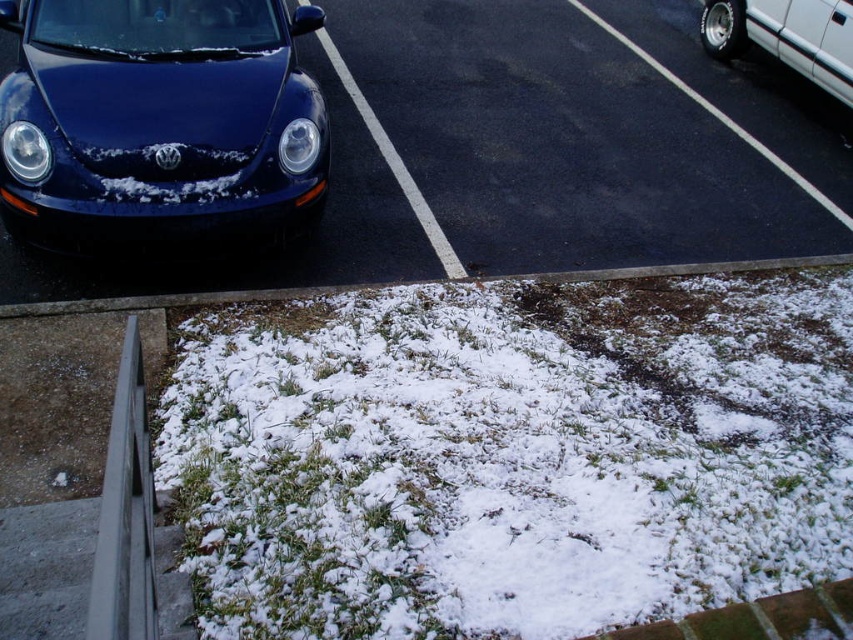
Can you confirm if matte blue car at left is smaller than white metallic car at upper right?

No, matte blue car at left is not smaller than white metallic car at upper right.

Consider the image. Is matte blue car at left to the right of white metallic car at upper right from the viewer's perspective?

In fact, matte blue car at left is to the left of white metallic car at upper right.

Does point (28, 131) come farther from viewer compared to point (790, 56)?

That is False.

In order to click on matte blue car at left in this screenshot , I will do `click(158, 120)`.

Does white fluffy snow at lower center have a greater width compared to snow-covered asphalt at upper center?

No, white fluffy snow at lower center is not wider than snow-covered asphalt at upper center.

What do you see at coordinates (509, 454) in the screenshot?
I see `white fluffy snow at lower center` at bounding box center [509, 454].

Locate an element on the screen. The width and height of the screenshot is (853, 640). white fluffy snow at lower center is located at coordinates (509, 454).

Is snow-covered asphalt at upper center shorter than white metallic car at upper right?

No, snow-covered asphalt at upper center is not shorter than white metallic car at upper right.

Can you confirm if snow-covered asphalt at upper center is positioned to the right of white metallic car at upper right?

No, snow-covered asphalt at upper center is not to the right of white metallic car at upper right.

Does point (759, 132) come farther from viewer compared to point (732, 42)?

No, (759, 132) is in front of (732, 42).

In order to click on snow-covered asphalt at upper center in this screenshot , I will do `click(535, 150)`.